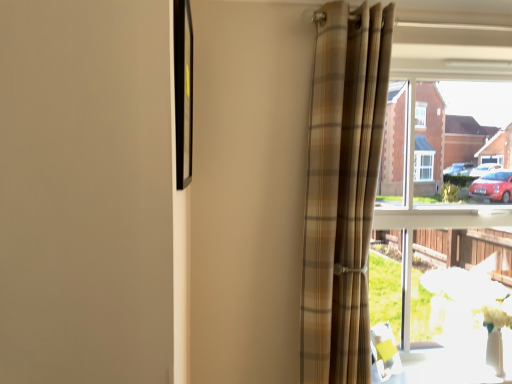
Question: Is white glossy table at lower right inside the boundaries of black glossy picture frame at upper left, or outside?

Choices:
 (A) outside
 (B) inside

Answer: (A)

Question: From a real-world perspective, is white glossy table at lower right above or below black glossy picture frame at upper left?

Choices:
 (A) below
 (B) above

Answer: (A)

Question: Considering the real-world distances, which object is farthest from the clear glass window at right?

Choices:
 (A) black glossy picture frame at upper left
 (B) white glossy table at lower right
 (C) plaid fabric curtain at right

Answer: (A)

Question: Which object is positioned farthest from the white glossy table at lower right?

Choices:
 (A) plaid fabric curtain at right
 (B) clear glass window at right
 (C) black glossy picture frame at upper left

Answer: (C)